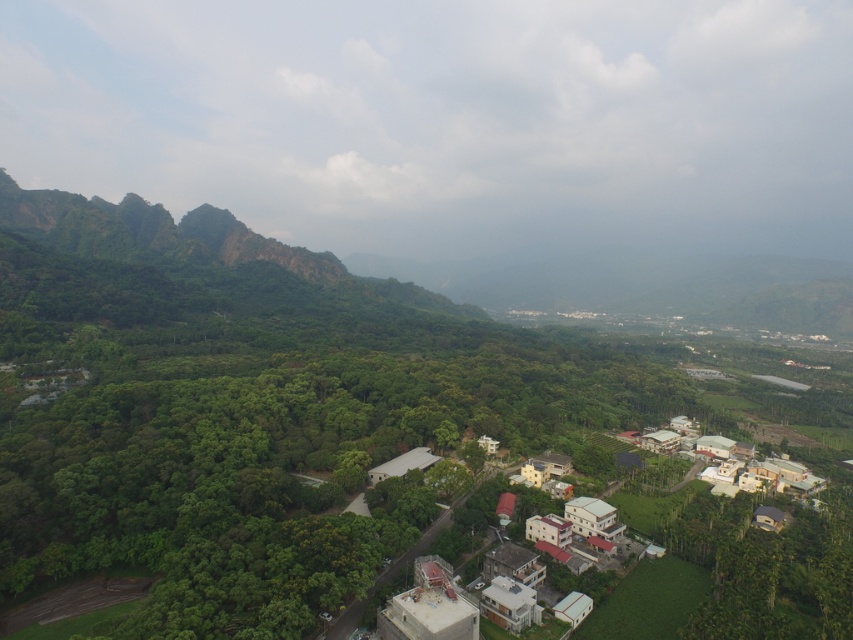
You are planning to take a photo of the green leafy trees at center and the white matte houses at lower right. Which object should you focus on first if you want to capture both in the same frame without moving the camera?

The green leafy trees at center should be focused on first because their width is larger than the white matte houses at lower right, so they will occupy more space in the frame, ensuring both can be captured without needing to adjust the camera position.

Consider the image. You are standing at the point with coordinates point (770, 576) and want to walk to point (160, 428). Which direction should you move in to reach your destination?

To reach point (160, 428) from point (770, 576), you should move towards the lower left direction since point (160, 428) is behind point (770, 576).

You are a delivery drone flying over the landscape and need to deliver a package to the white matte houses at lower right. There are green leafy trees at center blocking the direct path. Can you fly around the trees to the right side to reach the houses?

The green leafy trees at center are positioned on the left side of white matte houses at lower right, so flying around to the right side of the trees would allow you to reach the white matte houses at lower right without obstruction.